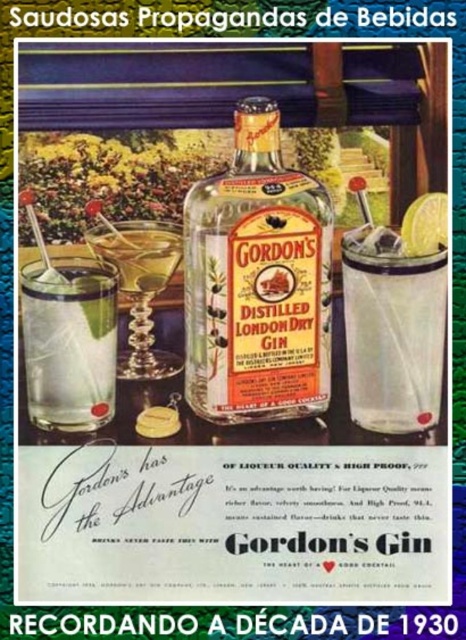
Is point (246, 221) closer to camera compared to point (431, 230)?

That is True.

Who is positioned more to the left, translucent glass bottle at center or yellow matte lime at upper right?

translucent glass bottle at center

Locate an element on the screen. translucent glass bottle at center is located at coordinates tap(257, 282).

Where is `translucent glass bottle at center`? The image size is (466, 640). translucent glass bottle at center is located at coordinates (257, 282).

Can you confirm if translucent glass bottle at center is positioned to the left of clear glass at lower left?

In fact, translucent glass bottle at center is to the right of clear glass at lower left.

How distant is translucent glass bottle at center from clear glass at lower left?

6.04 inches

Does point (278, 356) lie in front of point (107, 381)?

No, (278, 356) is behind (107, 381).

You are a GUI agent. You are given a task and a screenshot of the screen. Output one action in this format:
    pyautogui.click(x=<x>, y=<y>)
    Task: Click on the translucent glass bottle at center
    The width and height of the screenshot is (466, 640).
    Given the screenshot: What is the action you would take?
    pyautogui.click(x=257, y=282)

Which is above, translucent glass bottle at center or shiny silver martini glass at center-left?

translucent glass bottle at center

Where is `translucent glass bottle at center`? Image resolution: width=466 pixels, height=640 pixels. translucent glass bottle at center is located at coordinates point(257,282).

Locate an element on the screen. This screenshot has width=466, height=640. translucent glass bottle at center is located at coordinates (257, 282).